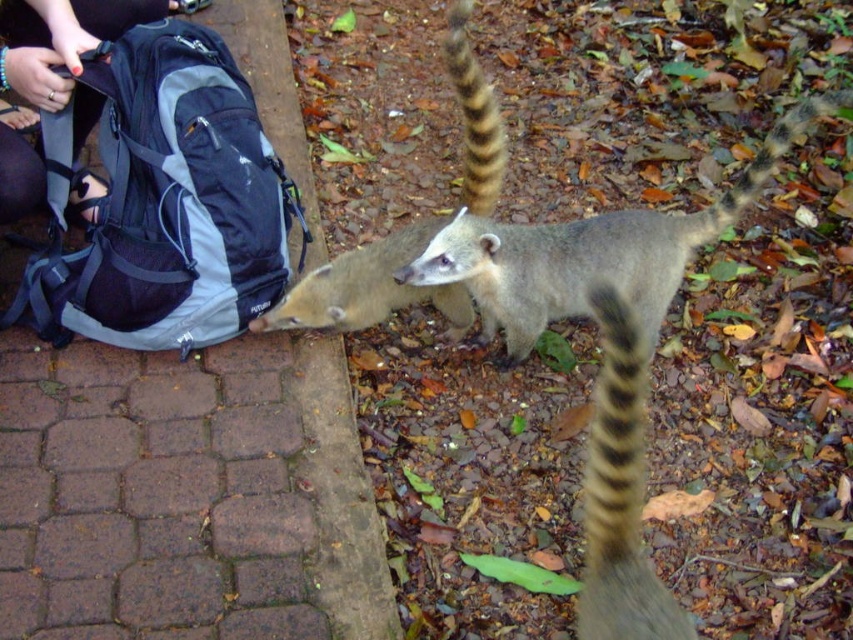
Question: Is brown fuzzy tail at upper right thinner than brown fur tail at center?

Choices:
 (A) yes
 (B) no

Answer: (A)

Question: Which object is closer to the camera taking this photo?

Choices:
 (A) dark gray backpack at left
 (B) brown fuzzy tail at upper right
 (C) brown fur tail at center

Answer: (A)

Question: Which point is farther to the camera?

Choices:
 (A) fuzzy gray lemur at center
 (B) brown/tan striped tail at right
 (C) brown fuzzy tail at upper right
 (D) brown fur coat at center

Answer: (C)

Question: Is fuzzy gray lemur at center above dark gray backpack at left?

Choices:
 (A) no
 (B) yes

Answer: (A)

Question: Which point appears closest to the camera in this image?

Choices:
 (A) (467, 186)
 (B) (675, 634)

Answer: (B)

Question: Can you confirm if brown fur coat at center is positioned to the right of brown fuzzy tail at upper right?

Choices:
 (A) no
 (B) yes

Answer: (A)